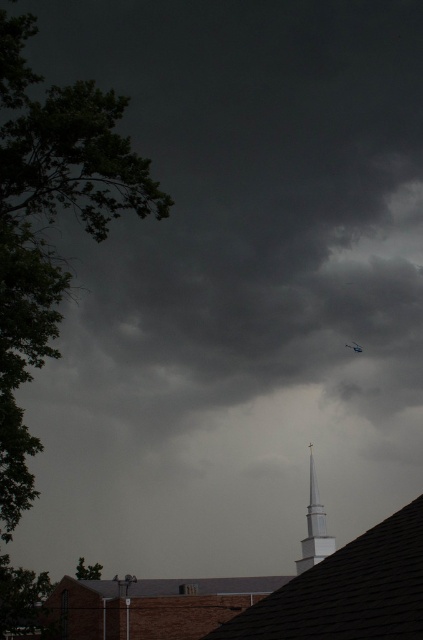
Question: Among these points, which one is nearest to the camera?

Choices:
 (A) (351, 344)
 (B) (321, 532)

Answer: (B)

Question: Which of the following is the closest to the observer?

Choices:
 (A) (308, 525)
 (B) (357, 344)

Answer: (A)

Question: Is white smooth steeple at center smaller than blue metallic plane at upper center?

Choices:
 (A) yes
 (B) no

Answer: (B)

Question: Does white smooth steeple at center appear on the left side of blue metallic plane at upper center?

Choices:
 (A) no
 (B) yes

Answer: (B)

Question: Does white smooth steeple at center come behind blue metallic plane at upper center?

Choices:
 (A) no
 (B) yes

Answer: (A)